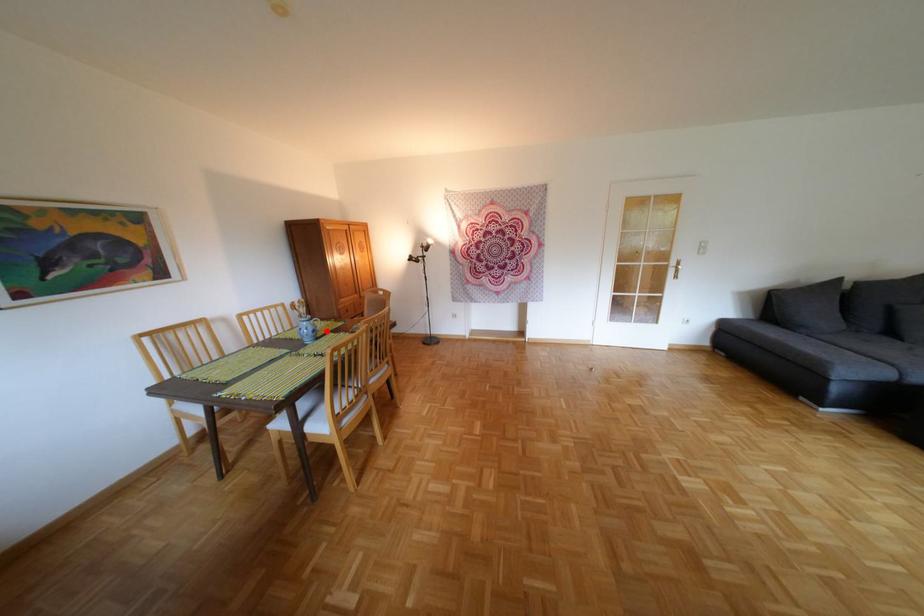
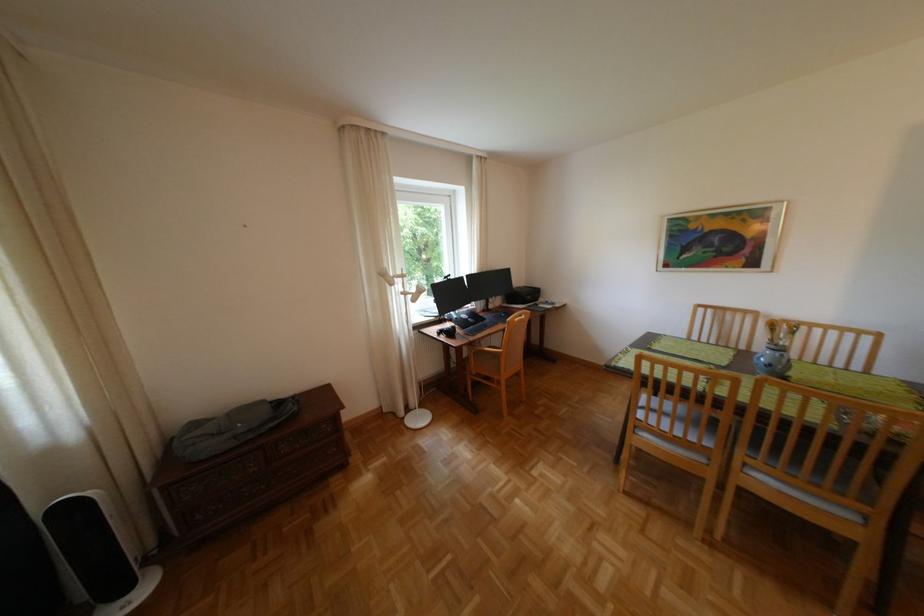
Question: I am providing you with two images of the same scene from different viewpoints. Given a red point in image1, look at the same physical point in image2. Is it:

Choices:
 (A) Closer to the viewpoint
 (B) Farther from the viewpoint

Answer: (B)